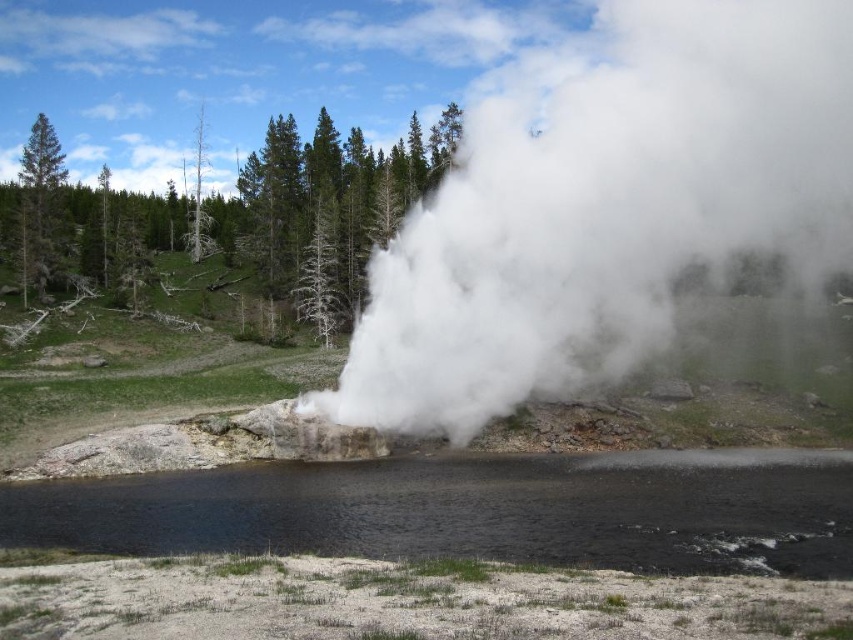
Based on the photo, you are a park ranger assessing the safety of the area around the geyser. You notice the white vapor at center and the green pine tree at upper center. Which object is positioned higher in the image?

The white vapor at center is above the green pine tree at upper center, so the white vapor at center is positioned higher in the image.

You are a park ranger observing the geothermal area. You notice the white vapor at center and the green pine tree at upper center. Which object is located to the right of the other?

The white vapor at center is positioned on the right side of green pine tree at upper center.